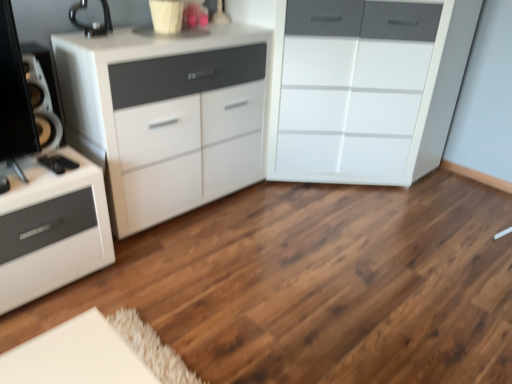
Question: Which direction should I rotate to face white glossy chest of drawers at center, placed as the 2th chest of drawers when sorted from left to right, — up or down?

Choices:
 (A) down
 (B) up

Answer: (B)

Question: Is white glossy cabinet at upper left, which is the first chest of drawers in left-to-right order, oriented away from white glossy chest of drawers at center, placed as the first chest of drawers when sorted from right to left?

Choices:
 (A) yes
 (B) no

Answer: (B)

Question: Could you tell me if white glossy cabinet at upper left, the 2th chest of drawers from the right, is turned towards white glossy chest of drawers at center, placed as the 2th chest of drawers when sorted from left to right?

Choices:
 (A) yes
 (B) no

Answer: (B)

Question: From a real-world perspective, is white glossy cabinet at upper left, the 2th chest of drawers from the right, positioned over white glossy chest of drawers at center, placed as the first chest of drawers when sorted from right to left, based on gravity?

Choices:
 (A) yes
 (B) no

Answer: (B)

Question: From the image's perspective, is white glossy cabinet at upper left, which is the first chest of drawers in left-to-right order, located above white glossy chest of drawers at center, placed as the first chest of drawers when sorted from right to left?

Choices:
 (A) yes
 (B) no

Answer: (B)

Question: Is the depth of white glossy cabinet at upper left, the 2th chest of drawers from the right, greater than that of white glossy chest of drawers at center, placed as the 2th chest of drawers when sorted from left to right?

Choices:
 (A) no
 (B) yes

Answer: (A)

Question: Is white glossy cabinet at upper left, which is the first chest of drawers in left-to-right order, wider than white glossy chest of drawers at center, placed as the first chest of drawers when sorted from right to left?

Choices:
 (A) yes
 (B) no

Answer: (B)

Question: From the image's perspective, is white glossy chest of drawers at center, placed as the first chest of drawers when sorted from right to left, under white glossy cabinet at upper left, the 2th chest of drawers from the right?

Choices:
 (A) no
 (B) yes

Answer: (A)

Question: Is white glossy chest of drawers at center, placed as the 2th chest of drawers when sorted from left to right, in contact with white glossy cabinet at upper left, which is the first chest of drawers in left-to-right order?

Choices:
 (A) yes
 (B) no

Answer: (B)

Question: Can you confirm if white glossy chest of drawers at center, placed as the first chest of drawers when sorted from right to left, is thinner than white glossy cabinet at upper left, the 2th chest of drawers from the right?

Choices:
 (A) no
 (B) yes

Answer: (A)

Question: Considering the relative sizes of white glossy chest of drawers at center, placed as the 2th chest of drawers when sorted from left to right, and white glossy cabinet at upper left, which is the first chest of drawers in left-to-right order, in the image provided, is white glossy chest of drawers at center, placed as the 2th chest of drawers when sorted from left to right, wider than white glossy cabinet at upper left, which is the first chest of drawers in left-to-right order,?

Choices:
 (A) yes
 (B) no

Answer: (A)

Question: From a real-world perspective, does white glossy chest of drawers at center, placed as the first chest of drawers when sorted from right to left, stand above white glossy cabinet at upper left, the 2th chest of drawers from the right?

Choices:
 (A) yes
 (B) no

Answer: (A)

Question: Can you confirm if white glossy chest of drawers at center, placed as the first chest of drawers when sorted from right to left, is taller than white glossy cabinet at upper left, which is the first chest of drawers in left-to-right order?

Choices:
 (A) yes
 (B) no

Answer: (A)

Question: Considering the relative positions of white glossy chest of drawers at center, placed as the first chest of drawers when sorted from right to left, and white glossy cabinet at upper left, the 2th chest of drawers from the right, in the image provided, is white glossy chest of drawers at center, placed as the first chest of drawers when sorted from right to left, to the left or to the right of white glossy cabinet at upper left, the 2th chest of drawers from the right,?

Choices:
 (A) left
 (B) right

Answer: (B)